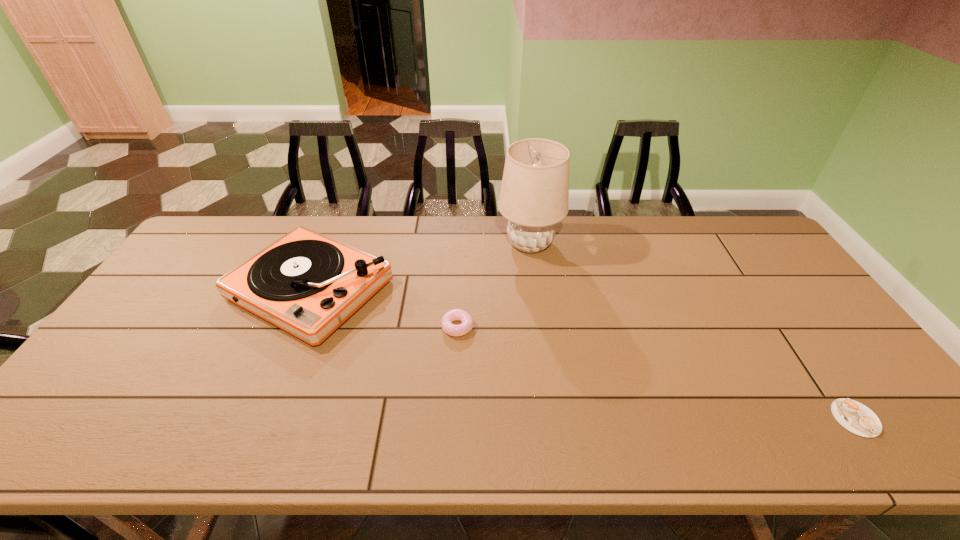
The width and height of the screenshot is (960, 540). What are the coordinates of `the tallest object` in the screenshot? It's located at (534, 195).

Where is `the second object from right to left`? The image size is (960, 540). the second object from right to left is located at coordinates (534, 195).

Locate an element on the screen. The height and width of the screenshot is (540, 960). the second tallest object is located at coordinates tap(307, 284).

You are a GUI agent. You are given a task and a screenshot of the screen. Output one action in this format:
    pyautogui.click(x=<x>, y=<y>)
    Task: Click on the leftmost object
    This screenshot has width=960, height=540.
    Given the screenshot: What is the action you would take?
    pyautogui.click(x=307, y=284)

This screenshot has width=960, height=540. Find the location of `the third object from right to left`. the third object from right to left is located at coordinates (467, 321).

Locate an element on the screen. The image size is (960, 540). the third tallest object is located at coordinates (467, 321).

Find the location of a particular element. cappuccino is located at coordinates (857, 418).

Identify the location of the nearest object. The width and height of the screenshot is (960, 540). (857, 418).

Image resolution: width=960 pixels, height=540 pixels. What are the coordinates of `vacant space positioned on the right of the second object from right to left` in the screenshot? It's located at (630, 244).

Where is `free space located on the left of the third shortest object`? free space located on the left of the third shortest object is located at coordinates (199, 288).